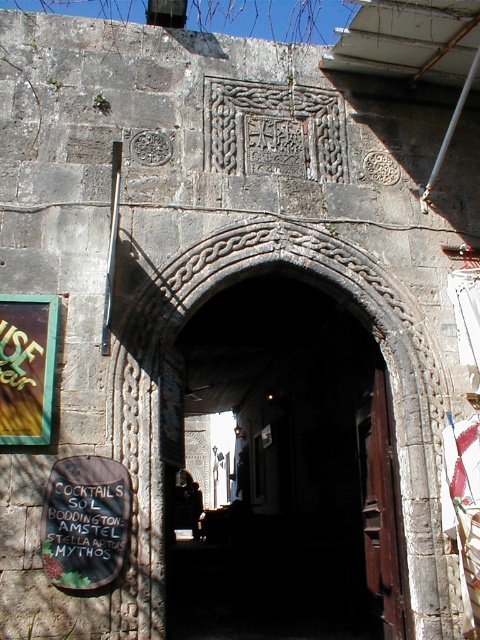
In the scene shown: You are standing in front of the stone archway and want to see the black paper sign at center. Where should you look relative to the archway?

The black paper sign at center is located at point (85, 522) relative to the archway, which means it is positioned to the right and slightly below the center of the archway.

You are standing in front of the dark stone archway at center and the green glass sign at left. Which object takes up more space in the image?

The green glass sign at left takes up more space in the image because the dark stone archway at center occupies less space than the green glass sign at left according to the description.

You are standing at the entrance of the alley under the stone archway and see two points marked in the image. Which point is closer to you, point (300,483) or point (70,506)?

Point (70,506) is closer to you because it is in front of point (300,483).